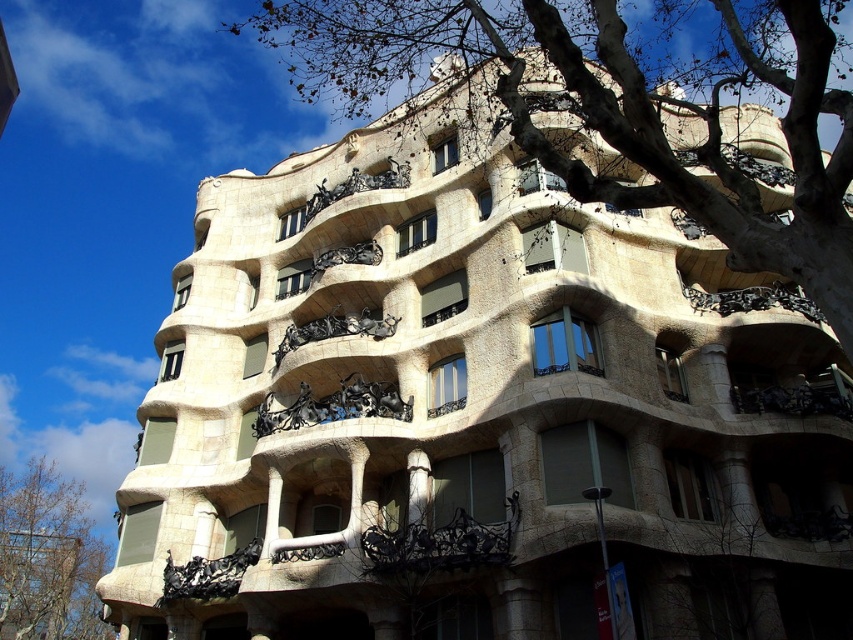
Can you confirm if bare branches at upper center is taller than brown leafy tree at lower left?

Yes.

The width and height of the screenshot is (853, 640). Describe the element at coordinates (624, 106) in the screenshot. I see `bare branches at upper center` at that location.

Is point (521, 17) farther from viewer compared to point (36, 557)?

That is False.

Locate an element on the screen. This screenshot has width=853, height=640. bare branches at upper center is located at coordinates (624, 106).